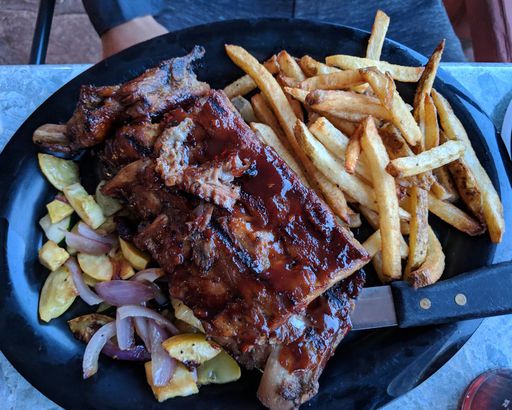
At what (x,y) coordinates should I click in order to perform the action: click on table. Please return your answer as a coordinate pair (x, y). The height and width of the screenshot is (410, 512). Looking at the image, I should click on (14, 84), (489, 78), (440, 389), (0, 389).